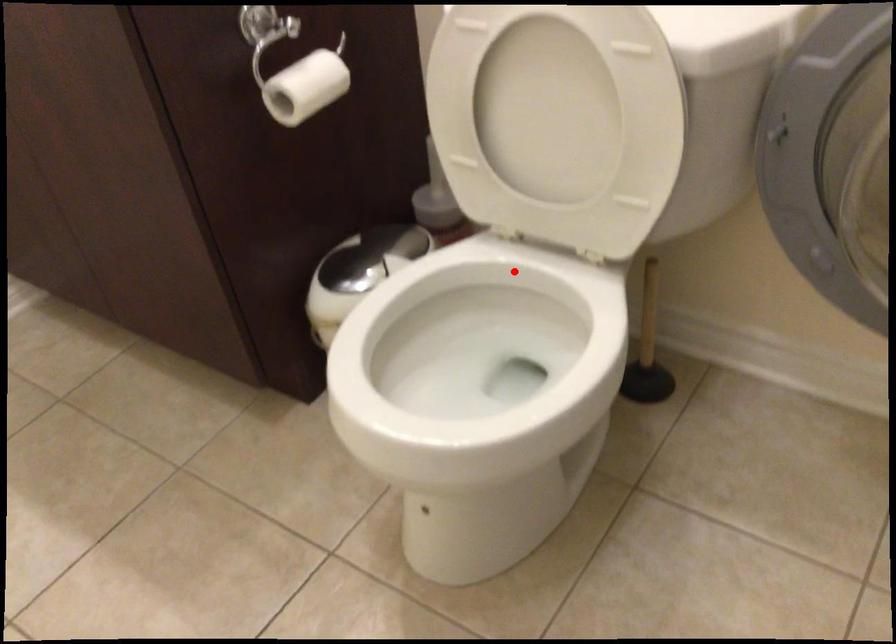
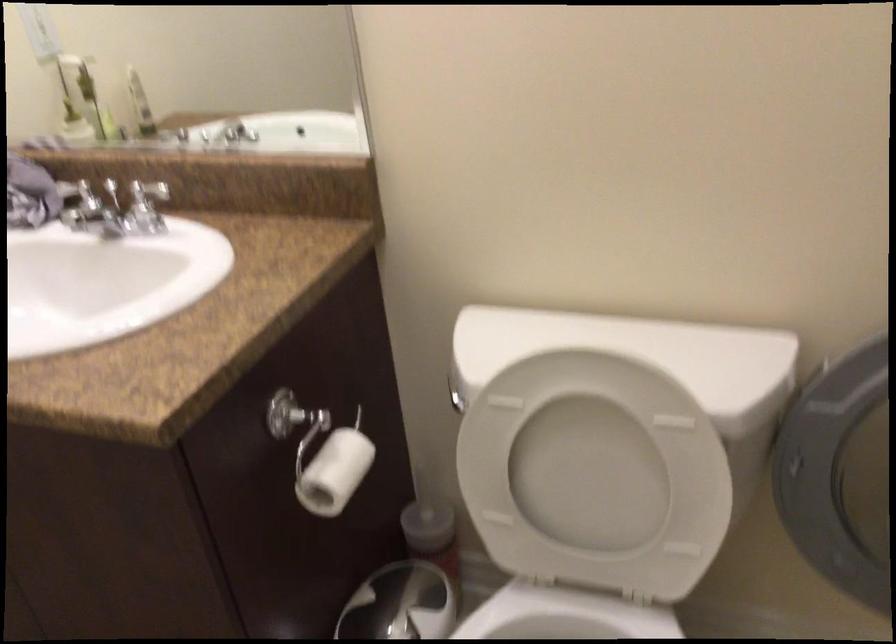
Locate, in the second image, the point that corresponds to the highlighted location in the first image.

(564, 616)